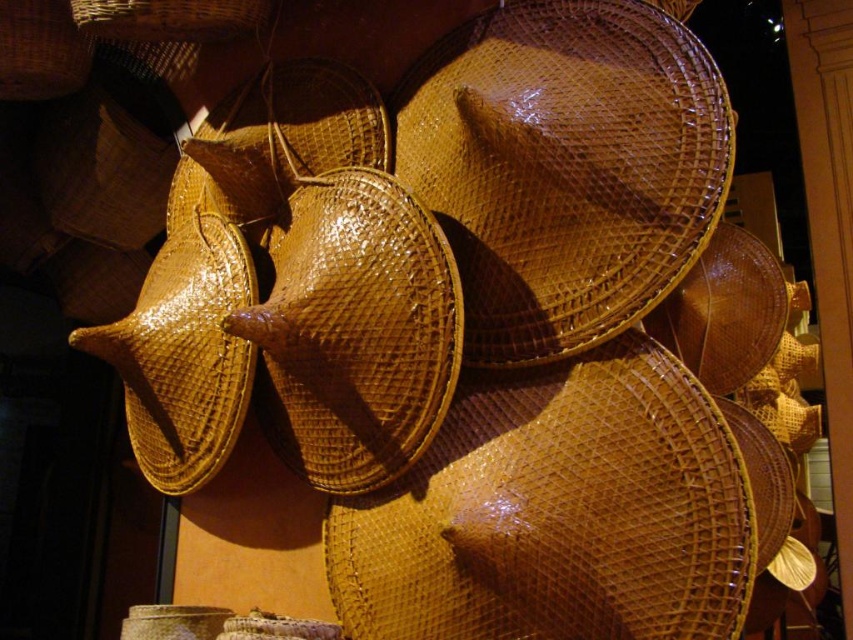
You are an interior designer planning to place a small potted plant between the matte brown woven basket at upper left and the woven brown basket at upper left. Which basket should the plant be closer to if you want it to be near the narrower one?

The matte brown woven basket at upper left has a lesser width compared to woven brown basket at upper left, so the plant should be placed closer to the matte brown woven basket at upper left to be near the narrower one.

You are standing in front of the display of traditional Vietnamese non la hats. You notice two points marked at coordinates point (13, 13) and point (235, 17). Which point is closer to you?

Point (13, 13) is further to the camera than point (235, 17), so the closer point to you is point (235, 17).

Where is the matte brown woven basket at upper left located in the image?

The matte brown woven basket at upper left is located at point (39, 51) in the image.